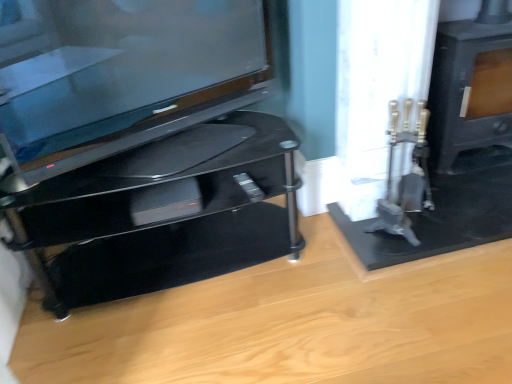
Find the location of a particular element. This screenshot has width=512, height=384. matte black stove at right is located at coordinates (471, 85).

Measure the distance between matte black stove at right and camera.

matte black stove at right and camera are 1.77 meters apart.

The width and height of the screenshot is (512, 384). What do you see at coordinates (121, 75) in the screenshot? I see `glossy black tv at left` at bounding box center [121, 75].

In order to click on matte black stove at right in this screenshot , I will do `click(471, 85)`.

Is glossy black tv at left far from black glossy tv stand at left?

glossy black tv at left is actually quite close to black glossy tv stand at left.

Between glossy black tv at left and black glossy tv stand at left, which one has smaller width?

With smaller width is glossy black tv at left.

Choose the correct answer: Is glossy black tv at left inside black glossy tv stand at left or outside it?

glossy black tv at left is spatially situated outside black glossy tv stand at left.

Locate an element on the screen. This screenshot has height=384, width=512. furniture lying on the left of glossy black tv at left is located at coordinates (160, 222).

Is matte black stove at right wider than glossy black tv at left?

Yes.

Locate an element on the screen. The width and height of the screenshot is (512, 384). television below the matte black stove at right (from the image's perspective) is located at coordinates (121, 75).

Is point (139, 112) behind point (484, 58)?

No, it is not.

What's the angular difference between glossy black tv at left and matte black stove at right's facing directions?

The angle between the facing direction of glossy black tv at left and the facing direction of matte black stove at right is 23.9 degrees.

Does glossy black tv at left have a lesser width compared to matte black stove at right?

Correct, the width of glossy black tv at left is less than that of matte black stove at right.

Locate an element on the screen. This screenshot has width=512, height=384. television in front of the matte black stove at right is located at coordinates (121, 75).

From the image's perspective, is black glossy tv stand at left above or below glossy black tv at left?

black glossy tv stand at left is situated lower than glossy black tv at left in the image.

From the picture: Is black glossy tv stand at left aimed at glossy black tv at left?

No, black glossy tv stand at left is not aimed at glossy black tv at left.

Does black glossy tv stand at left lie in front of glossy black tv at left?

No.

Measure the distance from black glossy tv stand at left to glossy black tv at left.

black glossy tv stand at left and glossy black tv at left are 14.31 inches apart from each other.

How many degrees apart are the facing directions of black glossy tv stand at left and matte black stove at right?

They differ by 1.88 degrees in their facing directions.

In terms of width, does black glossy tv stand at left look wider or thinner when compared to matte black stove at right?

In the image, black glossy tv stand at left appears to be wider than matte black stove at right.

Is black glossy tv stand at left facing towards matte black stove at right?

No.

Are matte black stove at right and black glossy tv stand at left far apart?

matte black stove at right is positioned a significant distance from black glossy tv stand at left.

From a real-world perspective, is matte black stove at right beneath black glossy tv stand at left?

No.

In the scene shown: Which of these two, matte black stove at right or black glossy tv stand at left, is wider?

black glossy tv stand at left.

Which is behind, matte black stove at right or black glossy tv stand at left?

Positioned behind is matte black stove at right.

The width and height of the screenshot is (512, 384). I want to click on television above the black glossy tv stand at left (from a real-world perspective), so click(121, 75).

Where is `stove above the glossy black tv at left (from the image's perspective)`? stove above the glossy black tv at left (from the image's perspective) is located at coordinates (471, 85).

Considering their positions, is black glossy tv stand at left positioned further to matte black stove at right than glossy black tv at left?

glossy black tv at left is further to matte black stove at right.

When comparing their distances from matte black stove at right, does glossy black tv at left or black glossy tv stand at left seem further?

glossy black tv at left is further to matte black stove at right.

Looking at the image, which one is located further to black glossy tv stand at left, matte black stove at right or glossy black tv at left?

matte black stove at right is positioned further to the anchor black glossy tv stand at left.

From the picture: From the image, which object appears to be farther from glossy black tv at left, black glossy tv stand at left or matte black stove at right?

matte black stove at right.

From the image, which object appears to be nearer to glossy black tv at left, matte black stove at right or black glossy tv stand at left?

black glossy tv stand at left lies closer to glossy black tv at left than the other object.

From the image, which object appears to be nearer to black glossy tv stand at left, glossy black tv at left or matte black stove at right?

glossy black tv at left is closer to black glossy tv stand at left.

I want to click on television between black glossy tv stand at left and matte black stove at right from left to right, so click(121, 75).